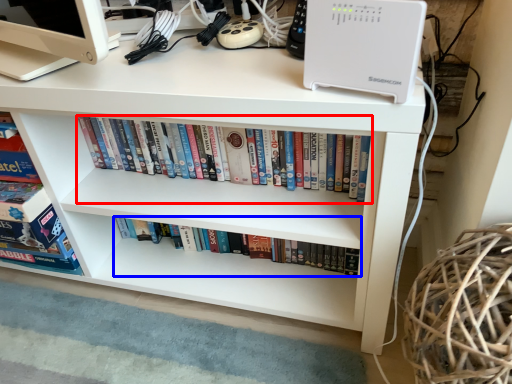
Question: Which object is closer to the camera taking this photo, book (highlighted by a red box) or book (highlighted by a blue box)?

Choices:
 (A) book
 (B) book

Answer: (A)